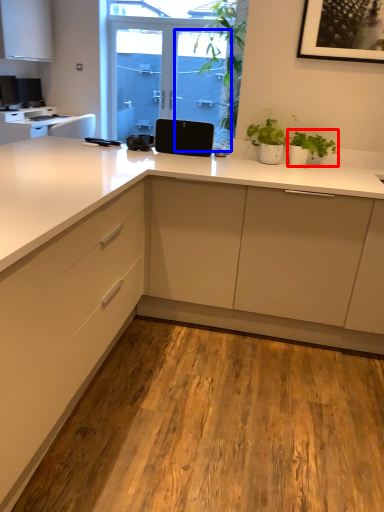
Question: Which point is closer to the camera, houseplant (highlighted by a red box) or screen door (highlighted by a blue box)?

Choices:
 (A) houseplant
 (B) screen door

Answer: (A)